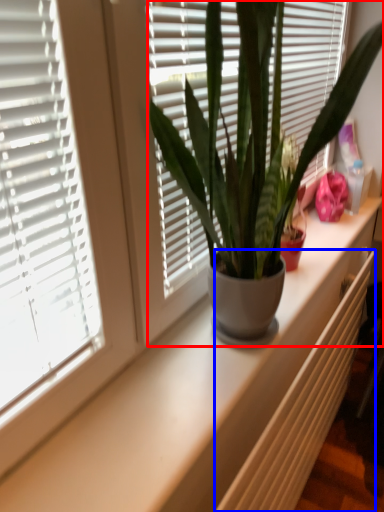
Question: Which object is further to the camera taking this photo, houseplant (highlighted by a red box) or radiator (highlighted by a blue box)?

Choices:
 (A) houseplant
 (B) radiator

Answer: (B)